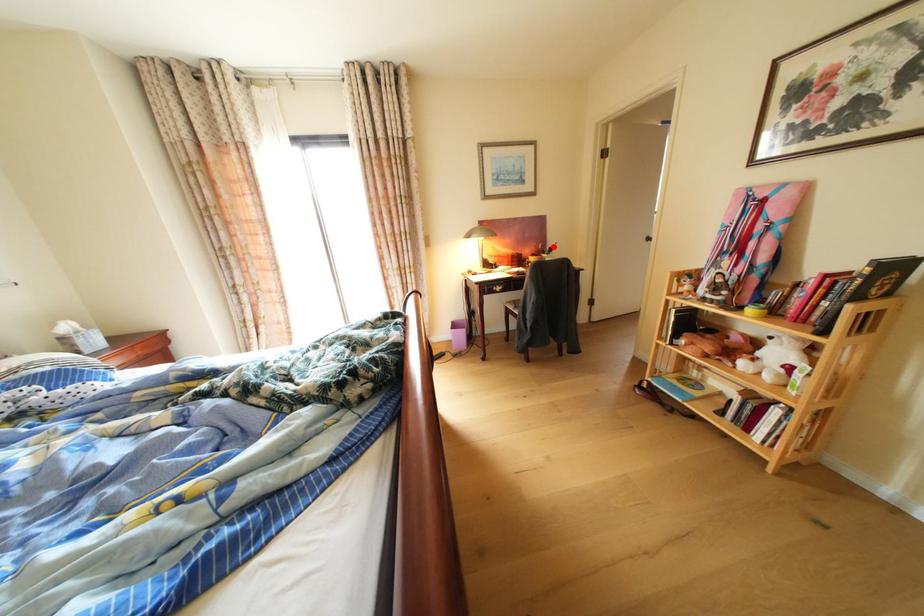
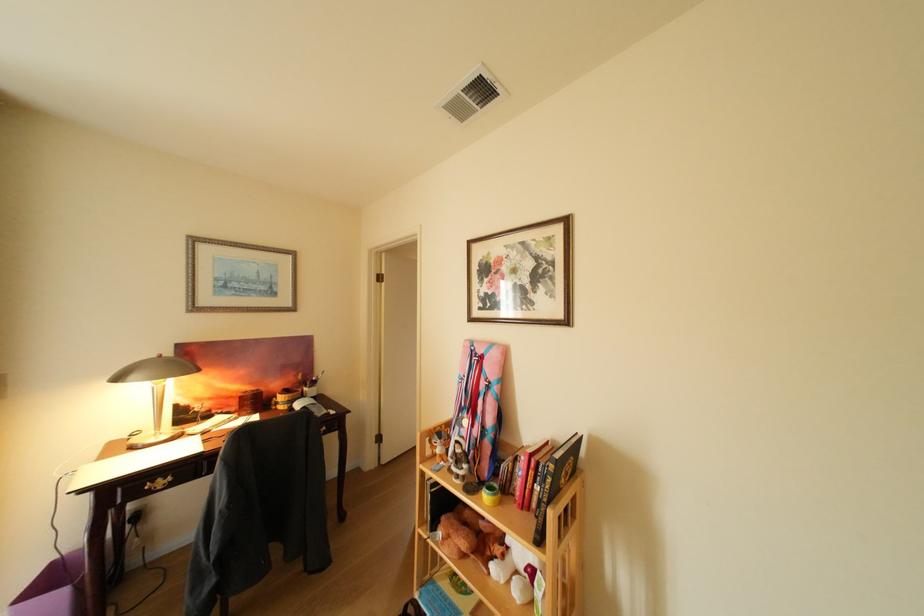
In the second image, find the point that corresponds to the highlighted location in the first image.

(313, 376)